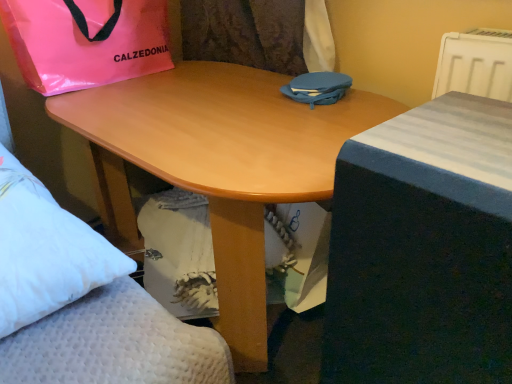
Image resolution: width=512 pixels, height=384 pixels. Identify the location of blank space to the left of blue fabric bag at center, placed as the 1th bag when sorted from right to left. (247, 94).